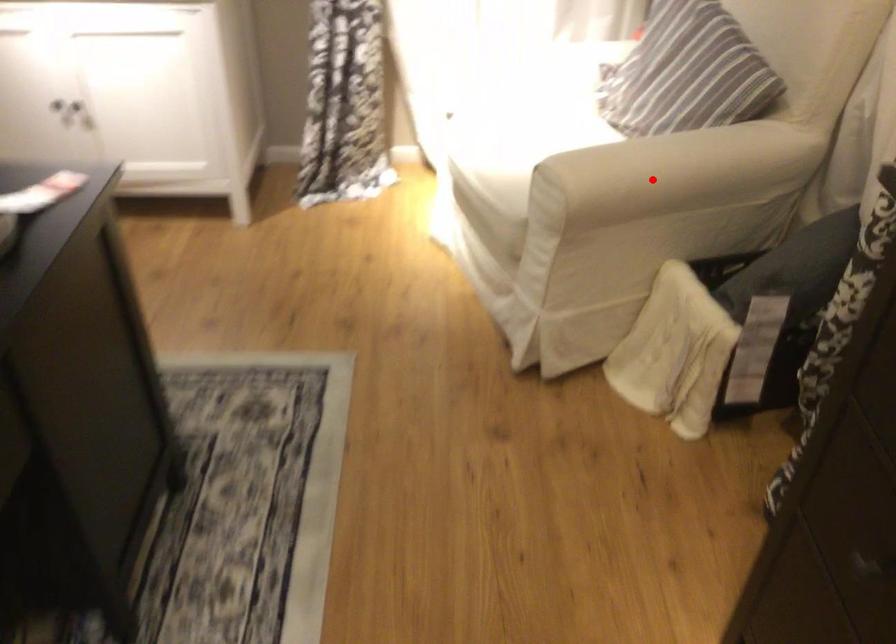
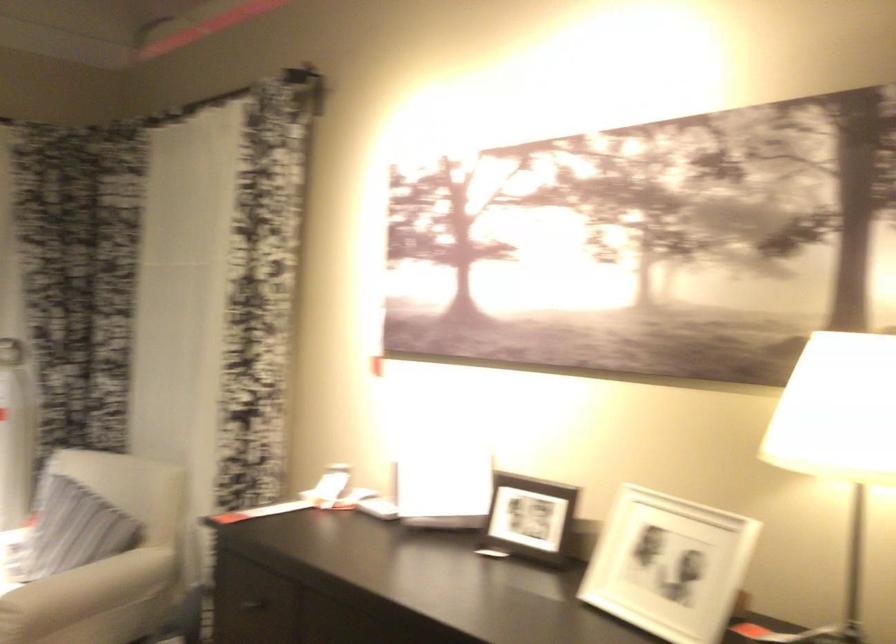
Question: I am providing you with two images of the same scene from different viewpoints. Image1 has a red point marked. In image2, the corresponding 3D location appears at what relative position? Reply with the corresponding letter.

Choices:
 (A) Closer
 (B) Farther

Answer: (B)